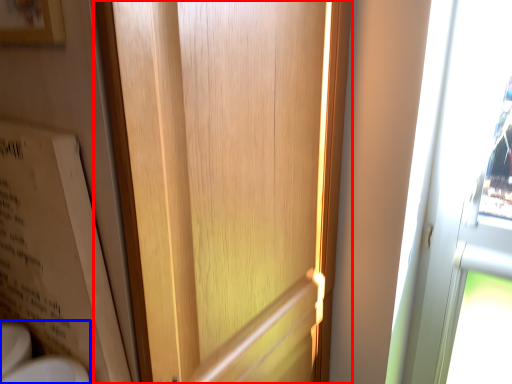
Question: Which object appears closest to the camera in this image, door (highlighted by a red box) or sink (highlighted by a blue box)?

Choices:
 (A) door
 (B) sink

Answer: (A)